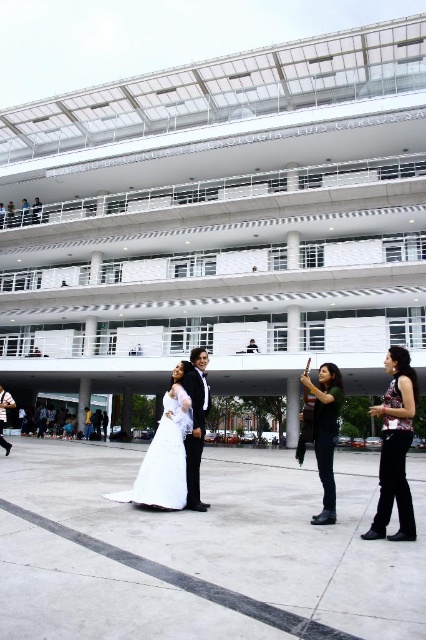
You are standing at the base of the building and see two points marked in the image. Which point, point [403,508] or point [405,422], is closer to you?

Point [403,508] is in front of point [405,422], so it is closer to you.

You are a photographer at the wedding and need to adjust the lighting. The white satin dress at lower center and the denim jacket at lower right are in your frame. Which object is closer to the camera?

The white satin dress at lower center is closer to the camera because it is in front of the denim jacket at lower right.

You are a photographer setting up for a wedding photoshoot at the science and technology building. You need to position the white satin dress at center and the denim jacket at lower right in the frame. Based on their sizes, which item will require more space in the composition?

The denim jacket at lower right requires more space in the composition because it occupies more area than the white satin dress at center according to the description.